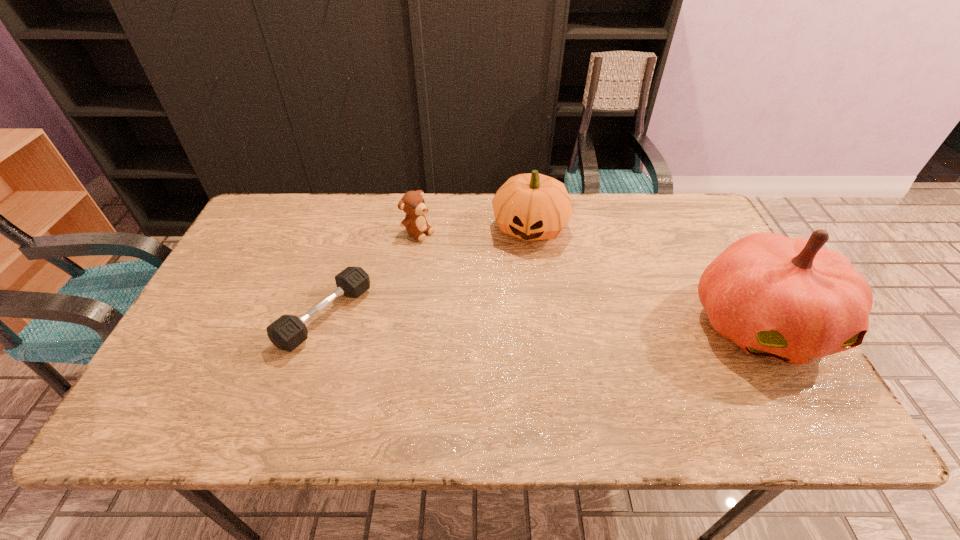
This screenshot has width=960, height=540. I want to click on vacant spot on the desktop that is between the shortest object and the tallest object and is positioned on the side of the second tallest object with the carved face, so click(x=510, y=319).

At what (x,y) coordinates should I click in order to perform the action: click on free space on the desktop that is between the dumbbell and the tallest object and is positioned on the face of the second shortest object. Please return your answer as a coordinate pair (x, y). The width and height of the screenshot is (960, 540). Looking at the image, I should click on (570, 320).